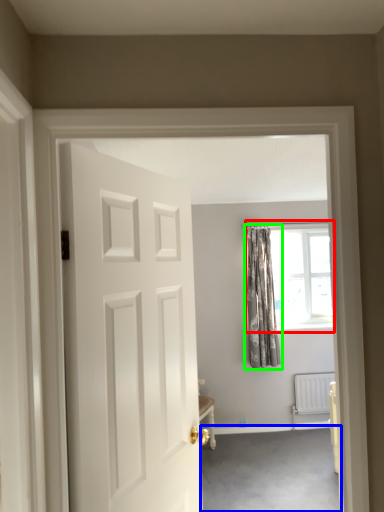
Question: Which object is positioned farthest from window (highlighted by a red box)? Select from plain (highlighted by a blue box) and curtain (highlighted by a green box).

Choices:
 (A) plain
 (B) curtain

Answer: (A)